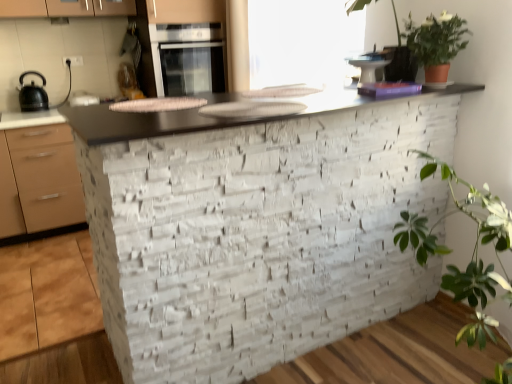
Question: Is green matte plant at upper right inside green leafy plant at upper right?

Choices:
 (A) yes
 (B) no

Answer: (B)

Question: Is green leafy plant at upper right positioned far away from green matte plant at upper right?

Choices:
 (A) no
 (B) yes

Answer: (A)

Question: Is green leafy plant at upper right shorter than green matte plant at upper right?

Choices:
 (A) yes
 (B) no

Answer: (B)

Question: Can you confirm if green leafy plant at upper right is wider than green matte plant at upper right?

Choices:
 (A) no
 (B) yes

Answer: (B)

Question: Considering the relative sizes of green leafy plant at upper right and green matte plant at upper right in the image provided, is green leafy plant at upper right smaller than green matte plant at upper right?

Choices:
 (A) yes
 (B) no

Answer: (B)

Question: Is green leafy plant at upper right bigger than green matte plant at upper right?

Choices:
 (A) no
 (B) yes

Answer: (B)

Question: Is matte black kettle at left closer to the viewer compared to white stone sink at center?

Choices:
 (A) no
 (B) yes

Answer: (A)

Question: Is matte black kettle at left to the right of white stone sink at center from the viewer's perspective?

Choices:
 (A) yes
 (B) no

Answer: (B)

Question: From the image's perspective, is matte black kettle at left located above white stone sink at center?

Choices:
 (A) yes
 (B) no

Answer: (A)

Question: Is white stone sink at center inside matte black kettle at left?

Choices:
 (A) yes
 (B) no

Answer: (B)

Question: Considering the relative positions of matte black kettle at left and white stone sink at center in the image provided, is matte black kettle at left to the left of white stone sink at center from the viewer's perspective?

Choices:
 (A) no
 (B) yes

Answer: (B)

Question: Does matte black kettle at left have a larger size compared to white stone sink at center?

Choices:
 (A) yes
 (B) no

Answer: (A)

Question: From the image's perspective, does smooth stone countertop at center appear lower than satin silver oven at upper center?

Choices:
 (A) no
 (B) yes

Answer: (B)